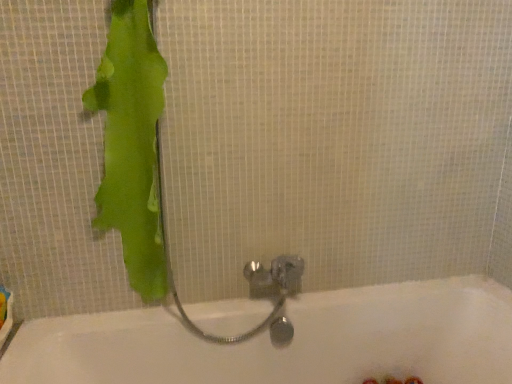
Question: Considering the positions of point (109, 44) and point (345, 301), is point (109, 44) closer or farther from the camera than point (345, 301)?

Choices:
 (A) farther
 (B) closer

Answer: (B)

Question: Is green matte towel at left inside the boundaries of white glossy bathtub at center, or outside?

Choices:
 (A) outside
 (B) inside

Answer: (A)

Question: Is green matte towel at left wider or thinner than white glossy bathtub at center?

Choices:
 (A) wide
 (B) thin

Answer: (B)

Question: Considering the relative positions of white glossy bathtub at center and green matte towel at left in the image provided, is white glossy bathtub at center to the left or to the right of green matte towel at left?

Choices:
 (A) left
 (B) right

Answer: (B)

Question: From a real-world perspective, relative to green matte towel at left, is white glossy bathtub at center vertically above or below?

Choices:
 (A) above
 (B) below

Answer: (B)

Question: Looking at their shapes, would you say white glossy bathtub at center is wider or thinner than green matte towel at left?

Choices:
 (A) thin
 (B) wide

Answer: (B)

Question: Choose the correct answer: Is white glossy bathtub at center inside green matte towel at left or outside it?

Choices:
 (A) inside
 (B) outside

Answer: (B)